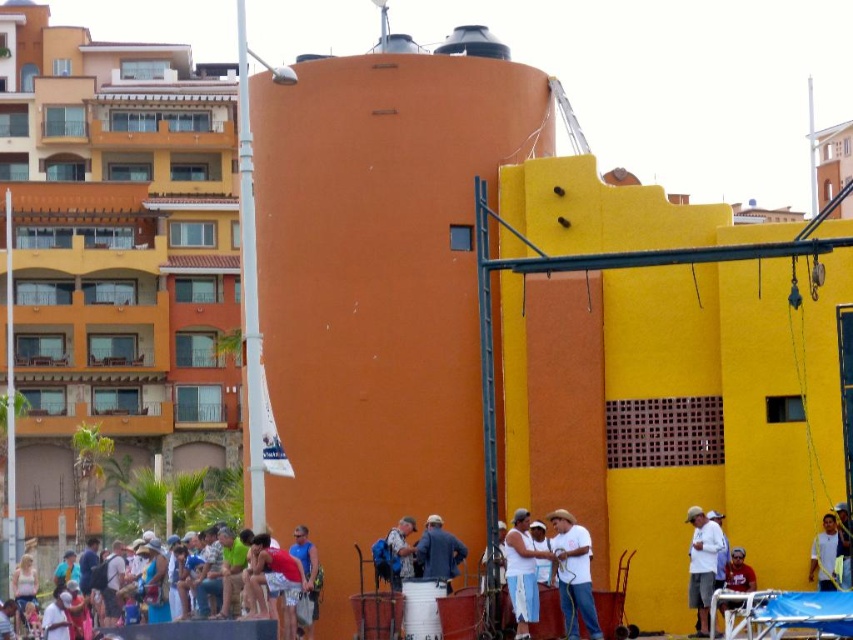
You are standing at a construction site and want to reach a specific point marked as point (563, 550). Given that you can walk 100 feet per minute, how many minutes will it take you to reach that point?

The distance between point (563, 550) and the viewer is 183.47 feet. At a walking speed of 100 feet per minute, it would take approximately 1.83 minutes to reach the point.

You are a safety inspector standing at the edge of the construction site. You notice two workers wearing a matte blue shirt at center and a white cotton shirt at center. Your task is to ensure they are maintaining a safe distance of at least 20 meters apart for safety protocols. Based on the scene, can you confirm if they are compliant with the safety distance requirement?

The distance between the matte blue shirt at center and the white cotton shirt at center is 17.91 meters, which is less than the required 20 meters. Therefore, they are not compliant with the safety distance requirement.